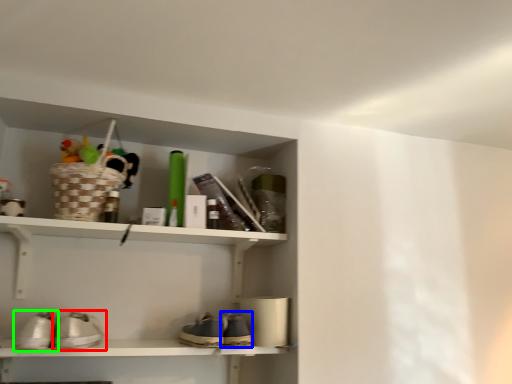
Question: Which object is the closest to the footwear (highlighted by a red box)? Choose among these: shoe (highlighted by a blue box) or footwear (highlighted by a green box).

Choices:
 (A) shoe
 (B) footwear

Answer: (B)